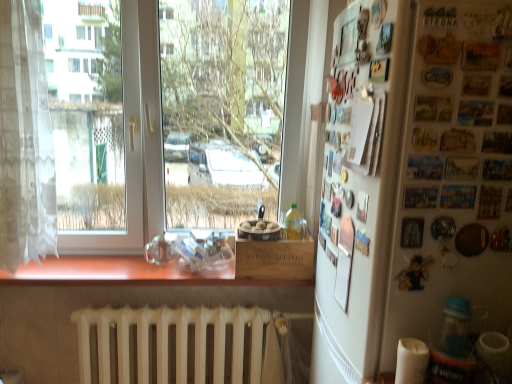
I want to click on white matte radiator at lower center, so click(x=183, y=345).

What do you see at coordinates (452, 174) in the screenshot?
I see `metallic silver magnets at right` at bounding box center [452, 174].

Locate an element on the screen. The width and height of the screenshot is (512, 384). brown wood at center is located at coordinates (123, 273).

What do you see at coordinates (162, 159) in the screenshot? This screenshot has height=384, width=512. I see `transparent glass window at center` at bounding box center [162, 159].

Describe the element at coordinates (293, 223) in the screenshot. The height and width of the screenshot is (384, 512). I see `yellow translucent bottle at center, the first bottle from the top` at that location.

Identify the location of white matte refrigerator at right. (359, 186).

I want to click on radiator beneath the metallic silver magnets at right (from a real-world perspective), so click(x=183, y=345).

Can you confirm if metallic silver magnets at right is smaller than white matte radiator at lower center?

Yes, metallic silver magnets at right is smaller than white matte radiator at lower center.

Is metallic silver magnets at right far from white matte radiator at lower center?

Absolutely, metallic silver magnets at right is distant from white matte radiator at lower center.

Does metallic silver magnets at right have a greater width compared to white matte radiator at lower center?

No.

Is white matte radiator at lower center turned away from metallic silver magnets at right?

No, white matte radiator at lower center's orientation is not away from metallic silver magnets at right.

Between white matte radiator at lower center and metallic silver magnets at right, which one has less height?

Standing shorter between the two is white matte radiator at lower center.

Find the location of a particular element. Image resolution: width=512 pixels, height=384 pixels. radiator on the left side of metallic silver magnets at right is located at coordinates (183, 345).

Are white matte radiator at lower center and metallic silver magnets at right far apart?

Yes.

Based on their positions, is white matte radiator at lower center located to the left or right of transparent glass window at center?

white matte radiator at lower center is positioned on transparent glass window at center's right side.

Looking at their sizes, would you say white matte radiator at lower center is wider or thinner than transparent glass window at center?

Considering their sizes, white matte radiator at lower center looks slimmer than transparent glass window at center.

Find the location of `window located above the white matte radiator at lower center (from the image's perspective)`. window located above the white matte radiator at lower center (from the image's perspective) is located at coordinates (162, 159).

Find the location of `fridge lying on the right of white matte radiator at lower center`. fridge lying on the right of white matte radiator at lower center is located at coordinates (359, 186).

Based on the photo, which is behind, white matte radiator at lower center or white matte refrigerator at right?

white matte radiator at lower center is behind.

In terms of size, does white matte radiator at lower center appear bigger or smaller than white matte refrigerator at right?

Considering their sizes, white matte radiator at lower center takes up more space than white matte refrigerator at right.

In terms of width, does white matte radiator at lower center look wider or thinner when compared to white matte refrigerator at right?

Clearly, white matte radiator at lower center has more width compared to white matte refrigerator at right.

From the image's perspective, which one is positioned higher, transparent glass window at center or translucent plastic bottle at lower right, the 2th bottle when ordered from back to front?

From the image's view, transparent glass window at center is above.

Which of these two, transparent glass window at center or translucent plastic bottle at lower right, marked as the 2th bottle in a top-to-bottom arrangement, is bigger?

Bigger between the two is transparent glass window at center.

Can you confirm if transparent glass window at center is positioned to the left of translucent plastic bottle at lower right, the first bottle from the front?

Yes.

Is point (198, 196) behind point (439, 131)?

Yes.

Based on the photo, from the image's perspective, is transparent glass window at center above or below metallic silver magnets at right?

Clearly, from the image's perspective, transparent glass window at center is above metallic silver magnets at right.

This screenshot has height=384, width=512. In the image, there is a transparent glass window at center. Identify the location of bulletin board below it (from the image's perspective). (452, 174).

Can you confirm if white lace curtain at left is taller than transparent glass window at center?

Incorrect, the height of white lace curtain at left is not larger of that of transparent glass window at center.

Looking at this image, does white lace curtain at left have a larger size compared to transparent glass window at center?

Incorrect, white lace curtain at left is not larger than transparent glass window at center.

Considering the relative positions of white lace curtain at left and transparent glass window at center in the image provided, is white lace curtain at left in front of transparent glass window at center?

Yes.

In the scene shown: Is white lace curtain at left far from transparent glass window at center?

Yes, white lace curtain at left and transparent glass window at center are located far from each other.

Where is `radiator below the metallic silver magnets at right (from the image's perspective)`? Image resolution: width=512 pixels, height=384 pixels. radiator below the metallic silver magnets at right (from the image's perspective) is located at coordinates (183, 345).

What are the coordinates of `bulletin board above the white matte radiator at lower center (from the image's perspective)` in the screenshot? It's located at (452, 174).

From the image, which object appears to be farther from translucent plastic bottle at lower right, which is counted as the second bottle, starting from the left, transparent glass window at center or white matte refrigerator at right?

Based on the image, transparent glass window at center appears to be further to translucent plastic bottle at lower right, which is counted as the second bottle, starting from the left.

Considering their positions, is translucent plastic bottle at lower right, the first bottle positioned from the right, positioned closer to yellow translucent bottle at center, which is the second bottle in right-to-left order, than brown wood at center?

brown wood at center is closer to yellow translucent bottle at center, which is the second bottle in right-to-left order.

When comparing their distances from transparent glass window at center, does white matte radiator at lower center or translucent plastic bottle at lower right, marked as the 2th bottle in a top-to-bottom arrangement, seem further?

The object further to transparent glass window at center is translucent plastic bottle at lower right, marked as the 2th bottle in a top-to-bottom arrangement.

Based on the photo, looking at the image, which one is located closer to transparent glass window at center, white lace curtain at left or yellow translucent bottle at center, which is the second bottle in front-to-back order?

yellow translucent bottle at center, which is the second bottle in front-to-back order, is positioned closer to the anchor transparent glass window at center.

Estimate the real-world distances between objects in this image. Which object is further from translucent plastic bottle at lower right, the first bottle positioned from the right, white matte refrigerator at right or brown wood at center?

brown wood at center is positioned further to the anchor translucent plastic bottle at lower right, the first bottle positioned from the right.

Looking at the image, which one is located closer to brown wood at center, transparent glass window at center or translucent plastic bottle at lower right, which is the 1th bottle in bottom-to-top order?

translucent plastic bottle at lower right, which is the 1th bottle in bottom-to-top order, is positioned closer to the anchor brown wood at center.

Which object lies further to the anchor point metallic silver magnets at right, transparent glass window at center or yellow translucent bottle at center, arranged as the first bottle when viewed from the left?

transparent glass window at center is positioned further to the anchor metallic silver magnets at right.

Considering their positions, is white matte refrigerator at right positioned further to metallic silver magnets at right than white lace curtain at left?

white lace curtain at left lies further to metallic silver magnets at right than the other object.

Image resolution: width=512 pixels, height=384 pixels. In order to click on fridge situated between transparent glass window at center and translucent plastic bottle at lower right, which is counted as the second bottle, starting from the left, from left to right in this screenshot , I will do `click(359, 186)`.

This screenshot has width=512, height=384. Identify the location of radiator situated between brown wood at center and metallic silver magnets at right from left to right. (183, 345).

Find the location of a particular element. fridge located between metallic silver magnets at right and yellow translucent bottle at center, marked as the first bottle in a back-to-front arrangement, in the depth direction is located at coordinates (359, 186).

The image size is (512, 384). In order to click on window between brown wood at center and metallic silver magnets at right in this screenshot , I will do `click(162, 159)`.